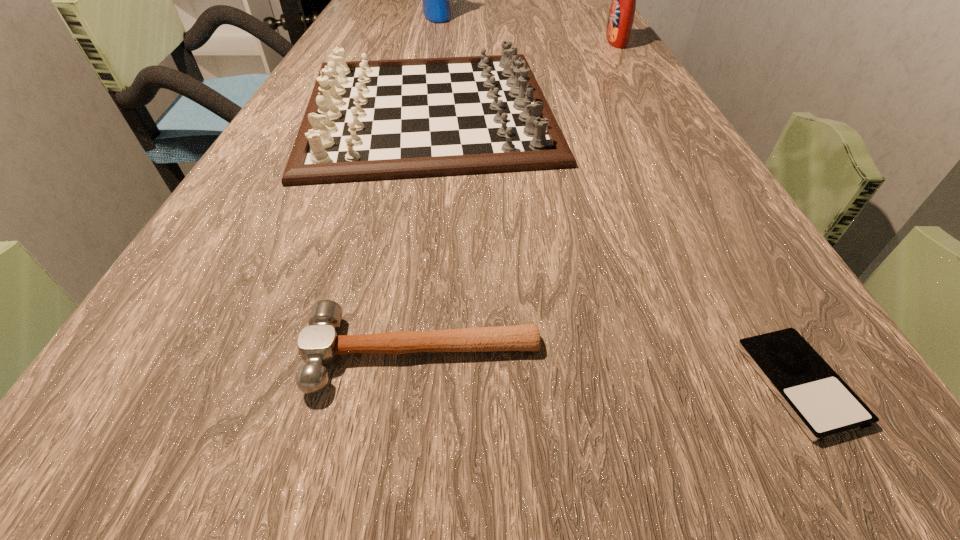
The width and height of the screenshot is (960, 540). What are the coordinates of `unoccupied position between the iPod and the third shortest object` in the screenshot? It's located at (613, 247).

Find the location of a particular element. The image size is (960, 540). object that is the fourth closest to the hammer is located at coordinates click(436, 6).

The width and height of the screenshot is (960, 540). What are the coordinates of `object that is the closest to the right detergent` in the screenshot? It's located at (374, 120).

At what (x,y) coordinates should I click in order to perform the action: click on free space that satisfies the following two spatial constraints: 1. on the back side of the fourth tallest object; 2. on the label of the farther detergent. Please return your answer as a coordinate pair (x, y). The height and width of the screenshot is (540, 960). Looking at the image, I should click on (459, 16).

You are a GUI agent. You are given a task and a screenshot of the screen. Output one action in this format:
    pyautogui.click(x=<x>, y=<y>)
    Task: Click on the free space that satisfies the following two spatial constraints: 1. on the label of the left detergent; 2. on the back side of the third farthest object
    The width and height of the screenshot is (960, 540).
    Given the screenshot: What is the action you would take?
    pyautogui.click(x=417, y=111)

Locate an element on the screen. This screenshot has height=540, width=960. free point that satisfies the following two spatial constraints: 1. on the front side of the third shortest object; 2. on the right side of the shortest object is located at coordinates (380, 383).

Locate an element on the screen. Image resolution: width=960 pixels, height=540 pixels. free point that satisfies the following two spatial constraints: 1. on the front surface of the fourth nearest object; 2. on the front side of the hammer is located at coordinates (809, 355).

The height and width of the screenshot is (540, 960). Find the location of `vacant area that satisfies the following two spatial constraints: 1. on the front surface of the nearer detergent; 2. on the front side of the hammer`. vacant area that satisfies the following two spatial constraints: 1. on the front surface of the nearer detergent; 2. on the front side of the hammer is located at coordinates (809, 355).

Where is `free region that satisfies the following two spatial constraints: 1. on the label of the hammer; 2. on the left side of the farther detergent`? free region that satisfies the following two spatial constraints: 1. on the label of the hammer; 2. on the left side of the farther detergent is located at coordinates coord(363,355).